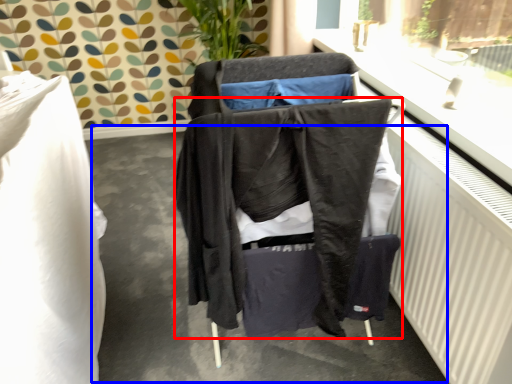
Question: Which of the following is the closest to the observer, jacket (highlighted by a red box) or concrete (highlighted by a blue box)?

Choices:
 (A) jacket
 (B) concrete

Answer: (A)